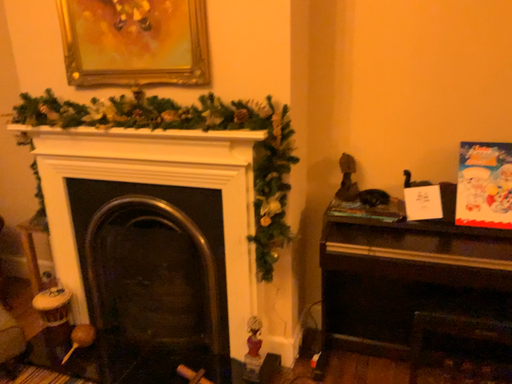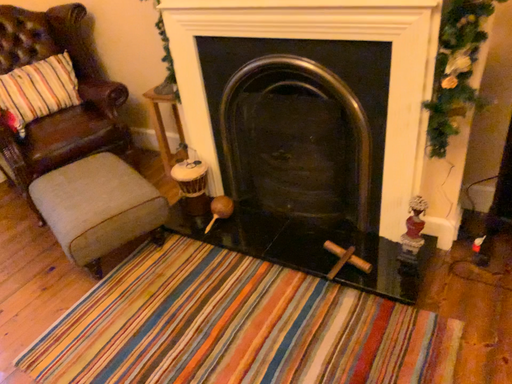
Question: Which way did the camera rotate in the video?

Choices:
 (A) rotated left
 (B) rotated right

Answer: (A)